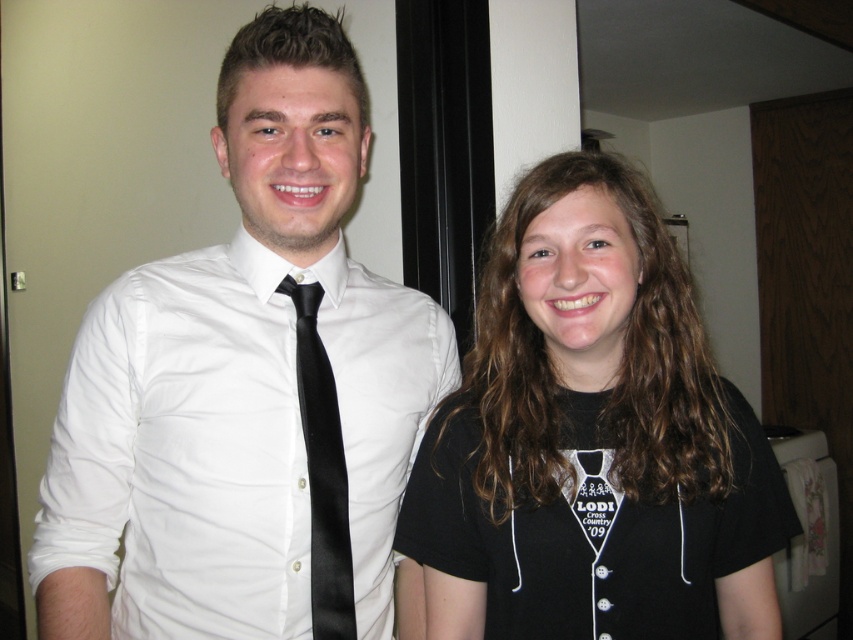
Question: Among these points, which one is nearest to the camera?

Choices:
 (A) (309, 416)
 (B) (579, 272)

Answer: (B)

Question: Observing the image, what is the correct spatial positioning of white satin shirt at center in reference to black satin tie at center?

Choices:
 (A) left
 (B) right

Answer: (A)

Question: Estimate the real-world distances between objects in this image. Which object is closer to the white satin shirt at center?

Choices:
 (A) black satin tie at center
 (B) black cotton t-shirt at center

Answer: (A)

Question: Estimate the real-world distances between objects in this image. Which object is farther from the black satin tie at center?

Choices:
 (A) black cotton t-shirt at center
 (B) white satin shirt at center

Answer: (A)

Question: Is white satin shirt at center further to camera compared to black satin tie at center?

Choices:
 (A) no
 (B) yes

Answer: (A)

Question: Is black cotton t-shirt at center further to the viewer compared to white satin shirt at center?

Choices:
 (A) yes
 (B) no

Answer: (B)